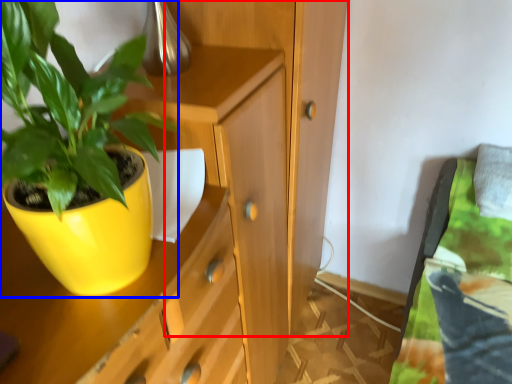
Question: Which object appears closest to the camera in this image, dresser (highlighted by a red box) or houseplant (highlighted by a blue box)?

Choices:
 (A) dresser
 (B) houseplant

Answer: (B)